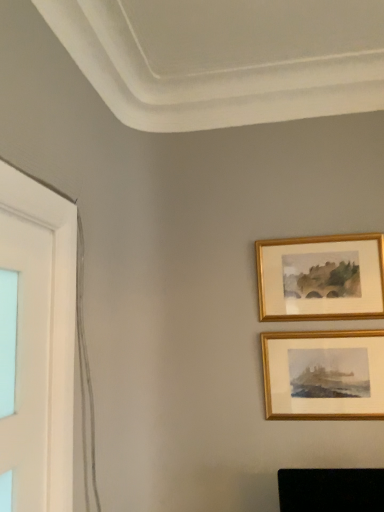
Question: Is gold/golden frame at upper right, the 2th picture frame when ordered from bottom to top, taller or shorter than gold/golden frame at upper right, which ranks as the first picture frame in bottom-to-top order?

Choices:
 (A) tall
 (B) short

Answer: (B)

Question: Does point (357, 298) appear closer or farther from the camera than point (326, 340)?

Choices:
 (A) closer
 (B) farther

Answer: (B)

Question: Is gold/golden frame at upper right, the 1th picture frame viewed from the top, situated inside gold/golden frame at upper right, which ranks as the first picture frame in bottom-to-top order, or outside?

Choices:
 (A) inside
 (B) outside

Answer: (B)

Question: From the image's perspective, is gold/golden frame at upper right, the second picture frame from the top, above or below gold/golden frame at upper right, the 2th picture frame when ordered from bottom to top?

Choices:
 (A) below
 (B) above

Answer: (A)

Question: Is point (299, 396) closer or farther from the camera than point (294, 305)?

Choices:
 (A) closer
 (B) farther

Answer: (A)

Question: Considering the positions of gold/golden frame at upper right, the second picture frame from the top, and gold/golden frame at upper right, the 2th picture frame when ordered from bottom to top, in the image, is gold/golden frame at upper right, the second picture frame from the top, bigger or smaller than gold/golden frame at upper right, the 2th picture frame when ordered from bottom to top,?

Choices:
 (A) small
 (B) big

Answer: (A)

Question: Is gold/golden frame at upper right, the second picture frame from the top, inside or outside of gold/golden frame at upper right, the 1th picture frame viewed from the top?

Choices:
 (A) outside
 (B) inside

Answer: (A)